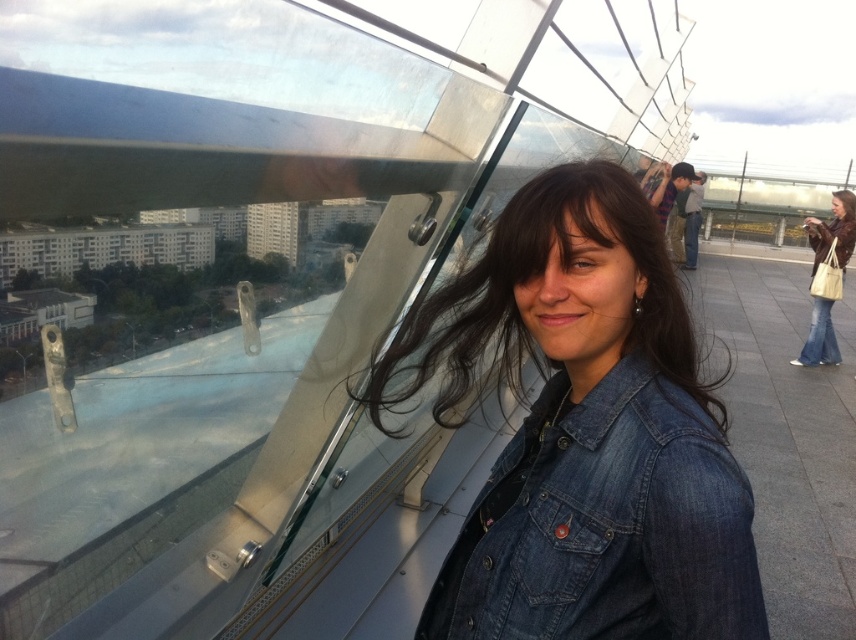
Between white glass building at upper left and matte brown leather jacket at lower right, which one has less height?

With less height is matte brown leather jacket at lower right.

Between white glass building at upper left and matte brown leather jacket at lower right, which one has more height?

white glass building at upper left is taller.

Where is `white glass building at upper left`? The image size is (856, 640). white glass building at upper left is located at coordinates (103, 248).

Is denim jacket at center further to camera compared to matte brown leather jacket at lower right?

No.

This screenshot has height=640, width=856. What do you see at coordinates (586, 433) in the screenshot? I see `denim jacket at center` at bounding box center [586, 433].

Who is more forward, (560,234) or (817,321)?

Point (560,234)

In order to click on denim jacket at center in this screenshot , I will do `click(586, 433)`.

Which is in front, point (155, 259) or point (849, 218)?

Point (849, 218) is in front.

I want to click on white glass building at upper left, so click(x=103, y=248).